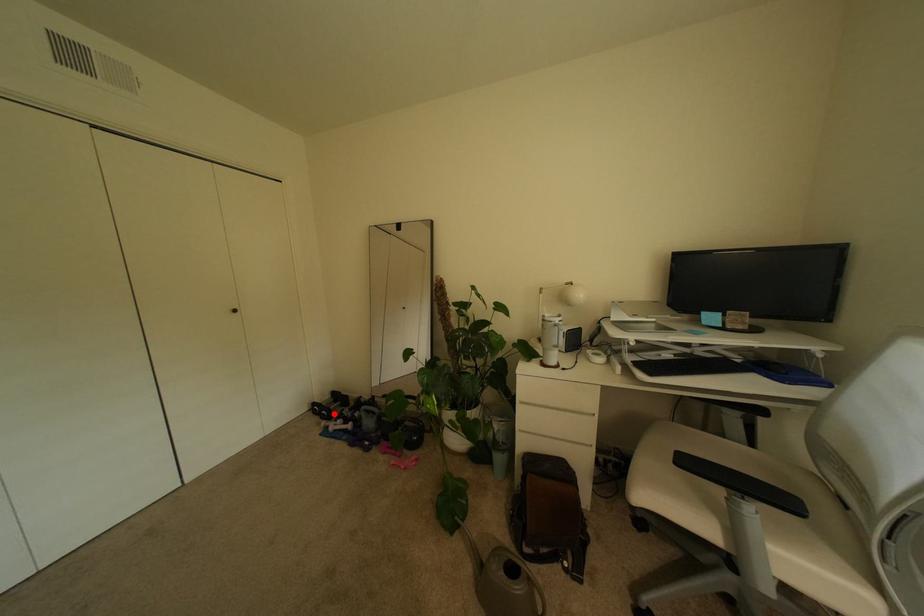
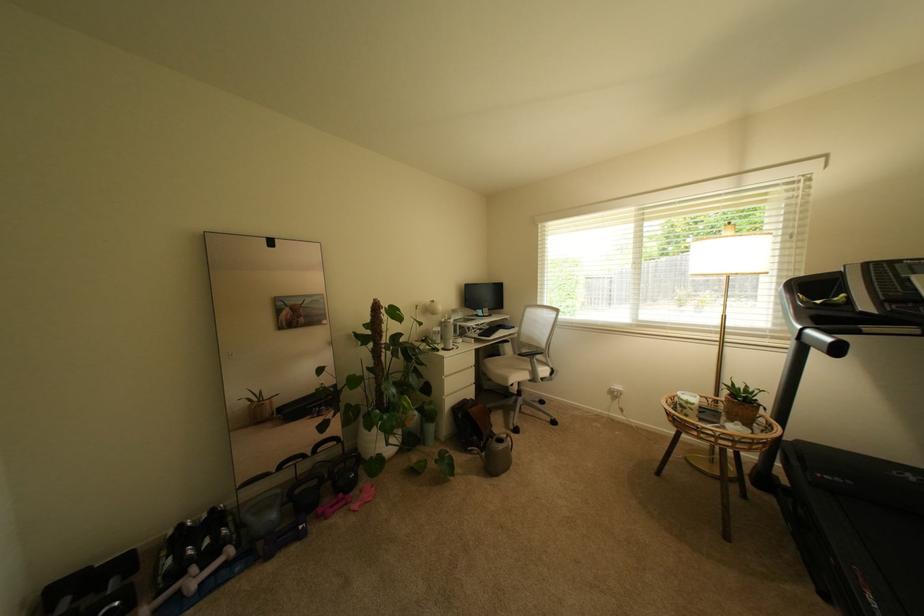
Question: I am providing you with two images of the same scene from different viewpoints. Image1 has a red point marked. In image2, the corresponding 3D location appears at what relative position? Reply with the corresponding letter.

Choices:
 (A) Closer
 (B) Farther

Answer: (A)